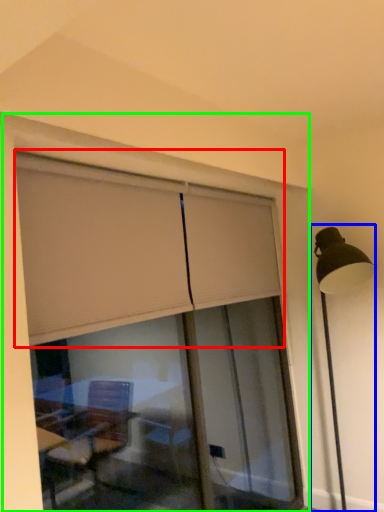
Question: Which object is the closest to the curtain (highlighted by a red box)? Choose among these: lamp post (highlighted by a blue box) or window frame (highlighted by a green box).

Choices:
 (A) lamp post
 (B) window frame

Answer: (B)